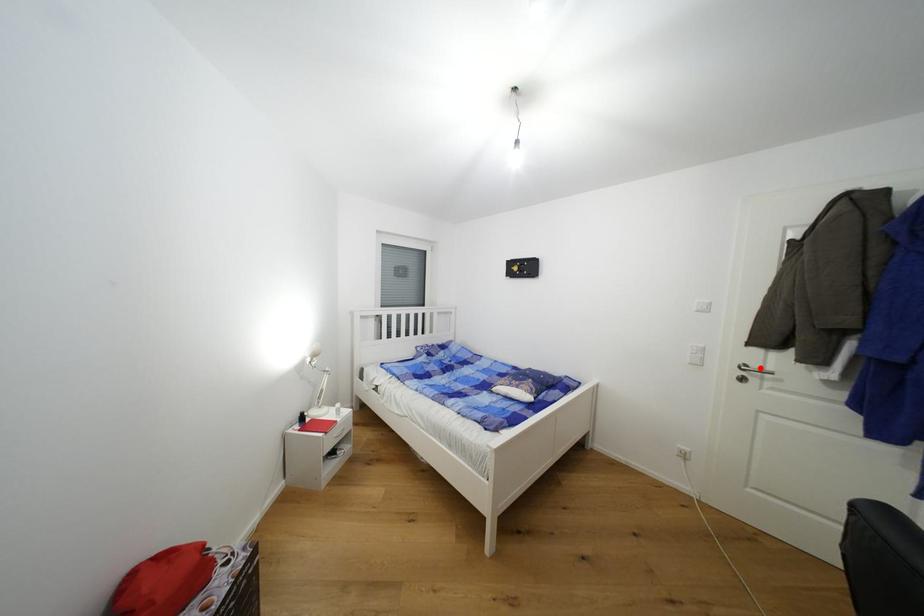
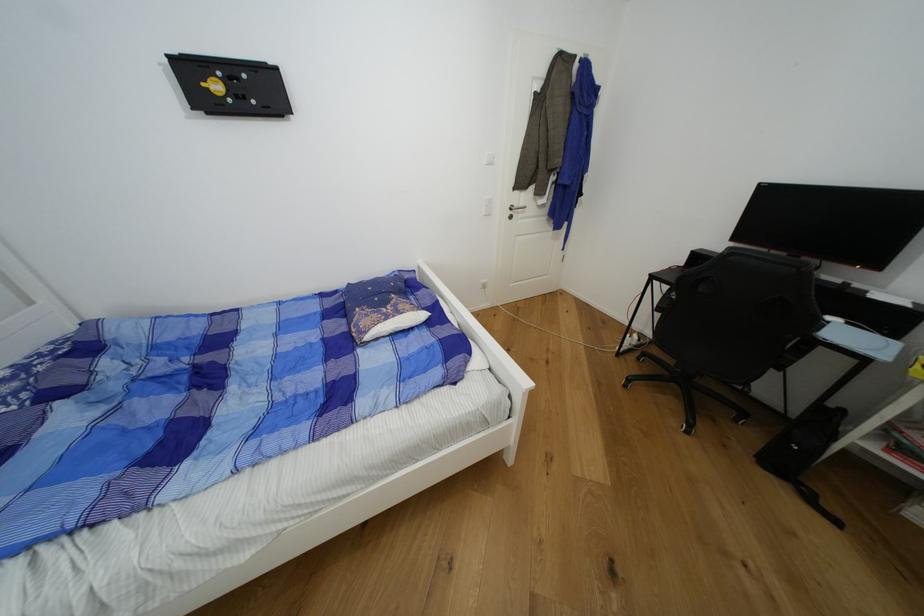
Find the pixel in the second image that matches the highlighted location in the first image.

(521, 207)